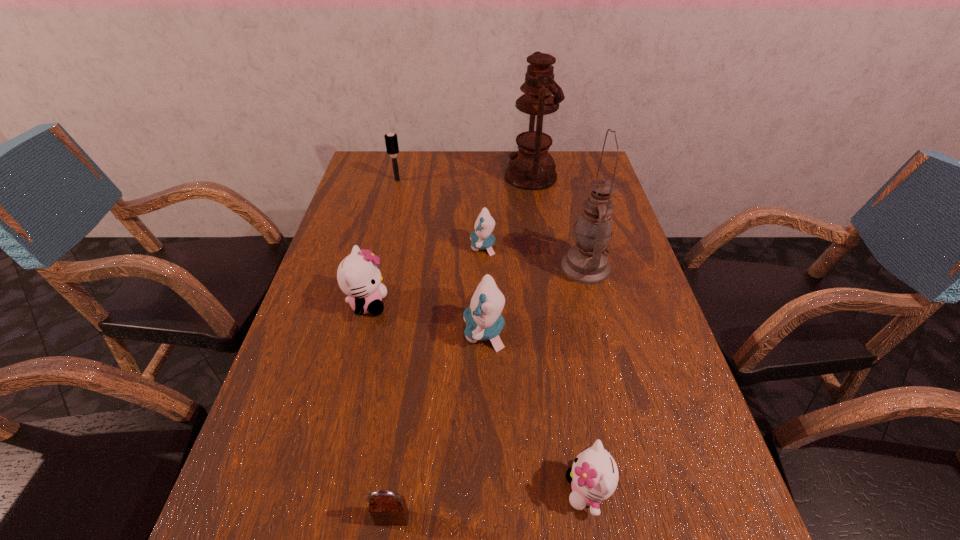
Where is `free point that satisfies the following two spatial constraints: 1. on the front side of the nearer oil lamp; 2. on the left side of the farther oil lamp`? free point that satisfies the following two spatial constraints: 1. on the front side of the nearer oil lamp; 2. on the left side of the farther oil lamp is located at coordinates (545, 267).